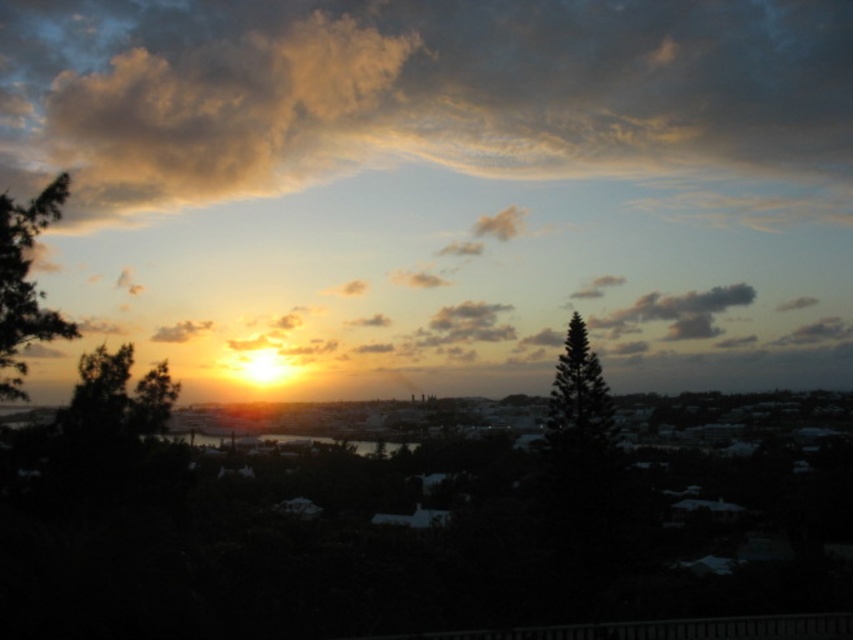
Can you confirm if green textured pine tree at center is wider than golden textured cloud at upper left?

No.

The width and height of the screenshot is (853, 640). Find the location of `green textured pine tree at center`. green textured pine tree at center is located at coordinates (579, 403).

Where is `green textured pine tree at center`? The image size is (853, 640). green textured pine tree at center is located at coordinates (579, 403).

Which is in front, point (50, 314) or point (173, 337)?

Point (50, 314) is more forward.

Image resolution: width=853 pixels, height=640 pixels. What do you see at coordinates (25, 284) in the screenshot?
I see `green leafy tree at left` at bounding box center [25, 284].

Between point (0, 339) and point (172, 326), which one is positioned in front?

Point (0, 339) is in front.

Locate an element on the screen. The width and height of the screenshot is (853, 640). green leafy tree at left is located at coordinates (25, 284).

Between golden cotton cloud at upper center and golden textured cloud at upper left, which one appears on the right side from the viewer's perspective?

golden cotton cloud at upper center

Who is more distant from viewer, (x=776, y=22) or (x=167, y=326)?

Positioned behind is point (x=776, y=22).

Identify the location of golden cotton cloud at upper center. (427, 97).